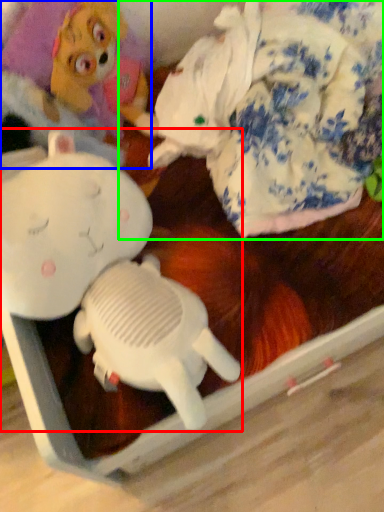
Question: Estimate the real-world distances between objects in this image. Which object is closer to toy (highlighted by a red box), toy (highlighted by a blue box) or toy (highlighted by a green box)?

Choices:
 (A) toy
 (B) toy

Answer: (A)